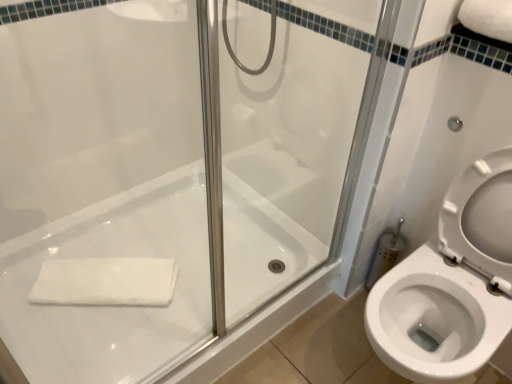
Question: From the image's perspective, is white cotton bath towel at lower left, which appears as the second bath towel when viewed from the right, located above white soft towel at upper right, marked as the second bath towel in a bottom-to-top arrangement?

Choices:
 (A) no
 (B) yes

Answer: (A)

Question: Is white cotton bath towel at lower left, which appears as the second bath towel when viewed from the right, wider than white soft towel at upper right, marked as the second bath towel in a bottom-to-top arrangement?

Choices:
 (A) yes
 (B) no

Answer: (B)

Question: Does white cotton bath towel at lower left, which is the first bath towel in left-to-right order, have a smaller size compared to white soft towel at upper right, acting as the 2th bath towel starting from the back?

Choices:
 (A) yes
 (B) no

Answer: (B)

Question: Is white cotton bath towel at lower left, which appears as the first bath towel when ordered from the bottom, taller than white soft towel at upper right, acting as the 1th bath towel starting from the front?

Choices:
 (A) yes
 (B) no

Answer: (B)

Question: Is white soft towel at upper right, marked as the second bath towel in a bottom-to-top arrangement, completely or partially inside white cotton bath towel at lower left, the 2th bath towel from the front?

Choices:
 (A) yes
 (B) no

Answer: (B)

Question: Based on their sizes in the image, would you say white soft towel at upper right, acting as the 1th bath towel starting from the front, is bigger or smaller than white cotton bath towel at lower left, arranged as the second bath towel when viewed from the top?

Choices:
 (A) small
 (B) big

Answer: (A)

Question: Considering the relative positions of white soft towel at upper right, arranged as the first bath towel when viewed from the right, and white cotton bath towel at lower left, which appears as the first bath towel when ordered from the bottom, in the image provided, is white soft towel at upper right, arranged as the first bath towel when viewed from the right, to the left or to the right of white cotton bath towel at lower left, which appears as the first bath towel when ordered from the bottom,?

Choices:
 (A) right
 (B) left

Answer: (A)

Question: Is white soft towel at upper right, marked as the second bath towel in a bottom-to-top arrangement, in front of or behind white cotton bath towel at lower left, which appears as the first bath towel when viewed from the back, in the image?

Choices:
 (A) behind
 (B) front

Answer: (B)

Question: From the image's perspective, is white soft towel at upper right, acting as the 1th bath towel starting from the front, positioned above or below white cotton bath towel at lower left, which appears as the second bath towel when viewed from the right?

Choices:
 (A) below
 (B) above

Answer: (B)

Question: From a real-world perspective, is white soft towel at upper right, acting as the 1th bath towel starting from the front, positioned above or below white glossy bath at center?

Choices:
 (A) below
 (B) above

Answer: (B)

Question: Is white soft towel at upper right, the 2th bath towel positioned from the left, in front of or behind white glossy bath at center in the image?

Choices:
 (A) behind
 (B) front

Answer: (B)

Question: In terms of width, does white soft towel at upper right, acting as the 1th bath towel starting from the front, look wider or thinner when compared to white glossy bath at center?

Choices:
 (A) thin
 (B) wide

Answer: (A)

Question: From the image's perspective, is white soft towel at upper right, arranged as the first bath towel when viewed from the right, located above or below white glossy bath at center?

Choices:
 (A) above
 (B) below

Answer: (A)

Question: Is white glossy bath at center taller or shorter than white soft towel at upper right, the first bath towel in the top-to-bottom sequence?

Choices:
 (A) short
 (B) tall

Answer: (B)

Question: Looking at the image, does white glossy bath at center seem bigger or smaller compared to white soft towel at upper right, arranged as the first bath towel when viewed from the right?

Choices:
 (A) small
 (B) big

Answer: (B)